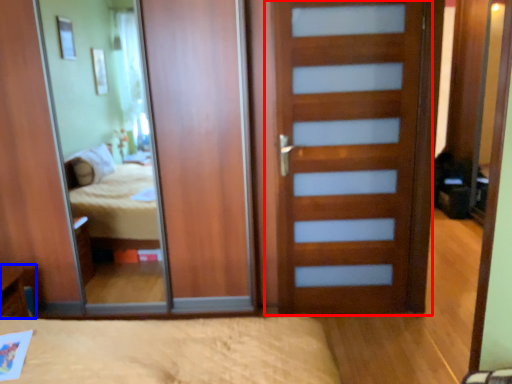
Question: Which object is further to the camera taking this photo, door (highlighted by a red box) or table (highlighted by a blue box)?

Choices:
 (A) door
 (B) table

Answer: (B)